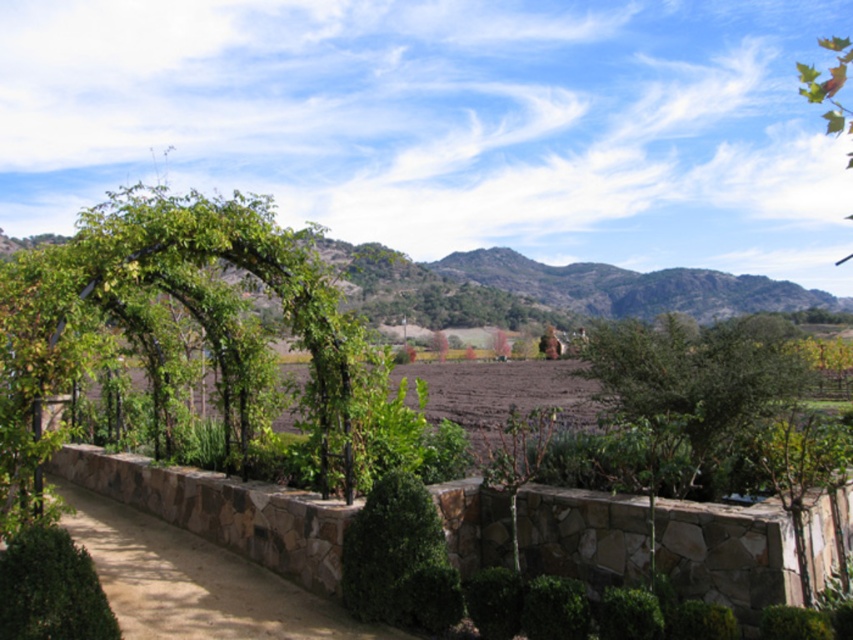
Who is lower down, green leafy tree at center or green leafy bush at lower left?

green leafy bush at lower left is below.

Is green leafy tree at center wider than green leafy bush at lower left?

Yes.

Between point (732, 388) and point (67, 572), which one is positioned behind?

Point (732, 388)

Locate an element on the screen. This screenshot has width=853, height=640. green leafy tree at center is located at coordinates (691, 387).